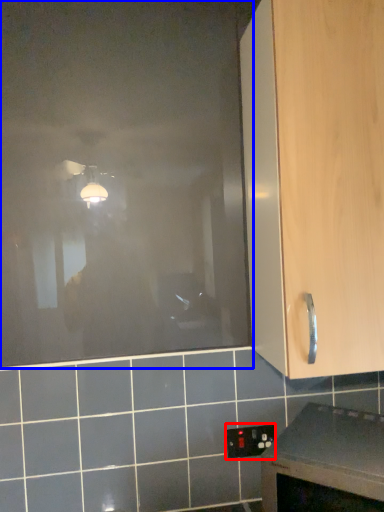
Question: Which of the following is the farthest to the observer, electric outlet (highlighted by a red box) or glass door (highlighted by a blue box)?

Choices:
 (A) electric outlet
 (B) glass door

Answer: (A)